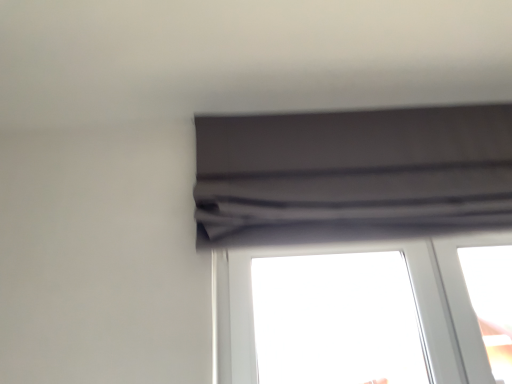
Question: Would you say transparent glass window at center is inside or outside matte gray curtain at upper center?

Choices:
 (A) outside
 (B) inside

Answer: (A)

Question: From the image's perspective, is transparent glass window at center positioned above or below matte gray curtain at upper center?

Choices:
 (A) above
 (B) below

Answer: (B)

Question: Is transparent glass window at center bigger or smaller than matte gray curtain at upper center?

Choices:
 (A) big
 (B) small

Answer: (B)

Question: From their relative heights in the image, would you say matte gray curtain at upper center is taller or shorter than transparent glass window at center?

Choices:
 (A) tall
 (B) short

Answer: (A)

Question: From the image's perspective, is matte gray curtain at upper center positioned above or below transparent glass window at center?

Choices:
 (A) below
 (B) above

Answer: (B)

Question: In the image, is matte gray curtain at upper center positioned in front of or behind transparent glass window at center?

Choices:
 (A) front
 (B) behind

Answer: (A)

Question: In the image, is matte gray curtain at upper center on the left side or the right side of transparent glass window at center?

Choices:
 (A) right
 (B) left

Answer: (A)